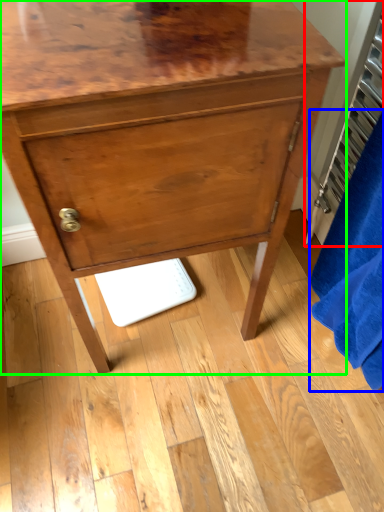
Question: Which object is the farthest from radiator (highlighted by a red box)? Choose among these: bath towel (highlighted by a blue box) or chest of drawers (highlighted by a green box).

Choices:
 (A) bath towel
 (B) chest of drawers

Answer: (B)